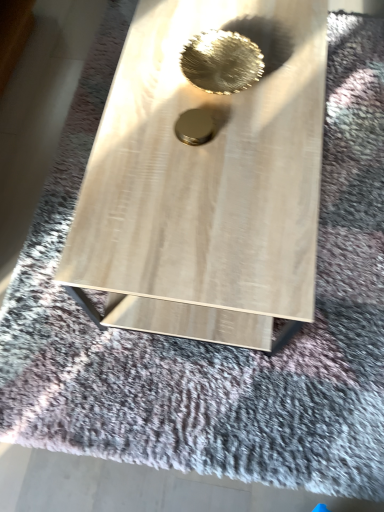
What do you see at coordinates (195, 126) in the screenshot?
I see `gold metallic circle at center, arranged as the first hole when ordered from the bottom` at bounding box center [195, 126].

Identify the location of gold metallic circle at center, arranged as the first hole when ordered from the bottom. coord(195,126).

Measure the distance between point (252, 42) and camera.

3.53 feet.

You are a GUI agent. You are given a task and a screenshot of the screen. Output one action in this format:
    pyautogui.click(x=<x>, y=<y>)
    Task: Click on the metallic gold bowl at center, arranged as the first hole when viewed from the top
    The width and height of the screenshot is (384, 512).
    Given the screenshot: What is the action you would take?
    pyautogui.click(x=222, y=61)

Image resolution: width=384 pixels, height=512 pixels. Describe the element at coordinates (222, 61) in the screenshot. I see `metallic gold bowl at center, acting as the 2th hole starting from the bottom` at that location.

Locate an element on the screen. This screenshot has height=512, width=384. gold metallic circle at center, arranged as the first hole when ordered from the bottom is located at coordinates (195, 126).

Considering the positions of objects gold metallic circle at center, arranged as the first hole when ordered from the bottom, and metallic gold bowl at center, arranged as the first hole when viewed from the top, in the image provided, who is more to the left, gold metallic circle at center, arranged as the first hole when ordered from the bottom, or metallic gold bowl at center, arranged as the first hole when viewed from the top,?

Positioned to the left is gold metallic circle at center, arranged as the first hole when ordered from the bottom.

Who is more distant, gold metallic circle at center, the second hole in the top-to-bottom sequence, or metallic gold bowl at center, acting as the 2th hole starting from the bottom?

metallic gold bowl at center, acting as the 2th hole starting from the bottom, is behind.

Between point (206, 132) and point (223, 49), which one is positioned in front?

The point (223, 49) is closer.

From the image's perspective, which object appears higher, gold metallic circle at center, the second hole in the top-to-bottom sequence, or metallic gold bowl at center, acting as the 2th hole starting from the bottom?

metallic gold bowl at center, acting as the 2th hole starting from the bottom, from the image's perspective.

From a real-world perspective, is gold metallic circle at center, arranged as the first hole when ordered from the bottom, on metallic gold bowl at center, arranged as the first hole when viewed from the top?

Incorrect, from a real-world perspective, gold metallic circle at center, arranged as the first hole when ordered from the bottom, is lower than metallic gold bowl at center, arranged as the first hole when viewed from the top.

Is gold metallic circle at center, the second hole in the top-to-bottom sequence, wider than metallic gold bowl at center, arranged as the first hole when viewed from the top?

In fact, gold metallic circle at center, the second hole in the top-to-bottom sequence, might be narrower than metallic gold bowl at center, arranged as the first hole when viewed from the top.

Between gold metallic circle at center, the second hole in the top-to-bottom sequence, and metallic gold bowl at center, arranged as the first hole when viewed from the top, which one has more height?

metallic gold bowl at center, arranged as the first hole when viewed from the top.

Considering the relative sizes of gold metallic circle at center, the second hole in the top-to-bottom sequence, and metallic gold bowl at center, arranged as the first hole when viewed from the top, in the image provided, is gold metallic circle at center, the second hole in the top-to-bottom sequence, smaller than metallic gold bowl at center, arranged as the first hole when viewed from the top,?

Yes.

Would you say gold metallic circle at center, arranged as the first hole when ordered from the bottom, is inside or outside metallic gold bowl at center, acting as the 2th hole starting from the bottom?

gold metallic circle at center, arranged as the first hole when ordered from the bottom, cannot be found inside metallic gold bowl at center, acting as the 2th hole starting from the bottom.

Is gold metallic circle at center, the second hole in the top-to-bottom sequence, placed right next to metallic gold bowl at center, acting as the 2th hole starting from the bottom?

No.

Could you tell me if gold metallic circle at center, arranged as the first hole when ordered from the bottom, is facing metallic gold bowl at center, acting as the 2th hole starting from the bottom?

No, gold metallic circle at center, arranged as the first hole when ordered from the bottom, does not turn towards metallic gold bowl at center, acting as the 2th hole starting from the bottom.

This screenshot has width=384, height=512. I want to click on hole to the left of metallic gold bowl at center, acting as the 2th hole starting from the bottom, so click(195, 126).

Considering the positions of objects metallic gold bowl at center, arranged as the first hole when viewed from the top, and gold metallic circle at center, the second hole in the top-to-bottom sequence, in the image provided, who is more to the right, metallic gold bowl at center, arranged as the first hole when viewed from the top, or gold metallic circle at center, the second hole in the top-to-bottom sequence,?

Positioned to the right is metallic gold bowl at center, arranged as the first hole when viewed from the top.

Which object is closer to the camera taking this photo, metallic gold bowl at center, acting as the 2th hole starting from the bottom, or gold metallic circle at center, the second hole in the top-to-bottom sequence?

Positioned in front is gold metallic circle at center, the second hole in the top-to-bottom sequence.

Does point (184, 67) come behind point (197, 139)?

No, (184, 67) is in front of (197, 139).

From the image's perspective, is metallic gold bowl at center, arranged as the first hole when viewed from the top, above or below gold metallic circle at center, arranged as the first hole when ordered from the bottom?

From the image's perspective, metallic gold bowl at center, arranged as the first hole when viewed from the top, appears above gold metallic circle at center, arranged as the first hole when ordered from the bottom.

From a real-world perspective, which is physically below, metallic gold bowl at center, arranged as the first hole when viewed from the top, or gold metallic circle at center, the second hole in the top-to-bottom sequence?

In real-world perspective, gold metallic circle at center, the second hole in the top-to-bottom sequence, is lower.

Looking at their sizes, would you say metallic gold bowl at center, arranged as the first hole when viewed from the top, is wider or thinner than gold metallic circle at center, the second hole in the top-to-bottom sequence?

Clearly, metallic gold bowl at center, arranged as the first hole when viewed from the top, has more width compared to gold metallic circle at center, the second hole in the top-to-bottom sequence.

Is metallic gold bowl at center, arranged as the first hole when viewed from the top, shorter than gold metallic circle at center, arranged as the first hole when ordered from the bottom?

In fact, metallic gold bowl at center, arranged as the first hole when viewed from the top, may be taller than gold metallic circle at center, arranged as the first hole when ordered from the bottom.

Can you confirm if metallic gold bowl at center, arranged as the first hole when viewed from the top, is smaller than gold metallic circle at center, the second hole in the top-to-bottom sequence?

Actually, metallic gold bowl at center, arranged as the first hole when viewed from the top, might be larger than gold metallic circle at center, the second hole in the top-to-bottom sequence.

In the scene shown: Do you think metallic gold bowl at center, acting as the 2th hole starting from the bottom, is within gold metallic circle at center, arranged as the first hole when ordered from the bottom, or outside of it?

metallic gold bowl at center, acting as the 2th hole starting from the bottom, lies outside gold metallic circle at center, arranged as the first hole when ordered from the bottom.

Is metallic gold bowl at center, arranged as the first hole when viewed from the top, touching gold metallic circle at center, arranged as the first hole when ordered from the bottom?

No, metallic gold bowl at center, arranged as the first hole when viewed from the top, is not in contact with gold metallic circle at center, arranged as the first hole when ordered from the bottom.

Is metallic gold bowl at center, acting as the 2th hole starting from the bottom, facing towards gold metallic circle at center, the second hole in the top-to-bottom sequence?

No.

Can you tell me how much metallic gold bowl at center, arranged as the first hole when viewed from the top, and gold metallic circle at center, arranged as the first hole when ordered from the bottom, differ in facing direction?

metallic gold bowl at center, arranged as the first hole when viewed from the top, and gold metallic circle at center, arranged as the first hole when ordered from the bottom, are facing 0.00452 degrees away from each other.

Looking at this image, could you measure the distance between metallic gold bowl at center, acting as the 2th hole starting from the bottom, and gold metallic circle at center, arranged as the first hole when ordered from the bottom?

metallic gold bowl at center, acting as the 2th hole starting from the bottom, is 1.10 meters away from gold metallic circle at center, arranged as the first hole when ordered from the bottom.

Locate an element on the screen. Image resolution: width=384 pixels, height=512 pixels. hole on the left of metallic gold bowl at center, acting as the 2th hole starting from the bottom is located at coordinates (195, 126).

This screenshot has width=384, height=512. In order to click on hole below the metallic gold bowl at center, arranged as the first hole when viewed from the top (from the image's perspective) in this screenshot , I will do `click(195, 126)`.

Identify the location of hole directly beneath the metallic gold bowl at center, arranged as the first hole when viewed from the top (from a real-world perspective). This screenshot has height=512, width=384. (195, 126).